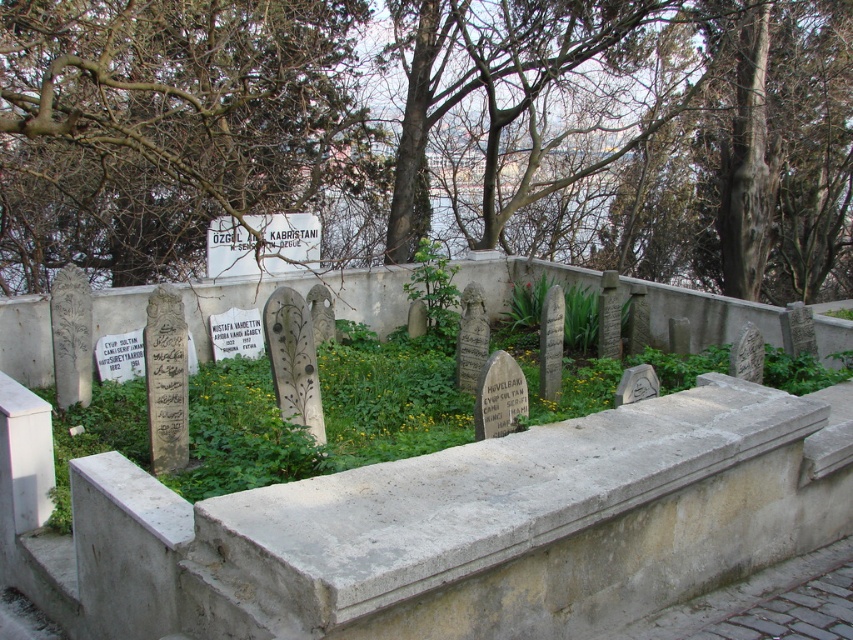
Question: Which object is closer to the camera taking this photo?

Choices:
 (A) bare branches at upper center
 (B) green leafy plant at center

Answer: (A)

Question: Is brown leafless tree at upper center further to camera compared to green leafy plant at center?

Choices:
 (A) yes
 (B) no

Answer: (B)

Question: From the image, what is the correct spatial relationship of brown leafless tree at upper center in relation to green leafy plant at center?

Choices:
 (A) above
 (B) below

Answer: (A)

Question: Which point is closer to the camera?

Choices:
 (A) bare branches at upper center
 (B) brown leafless tree at upper center
 (C) green leafy plant at center

Answer: (B)

Question: Which point is closer to the camera?

Choices:
 (A) brown leafless tree at upper center
 (B) bare branches at upper center
 (C) green leafy plant at center

Answer: (A)

Question: Does bare branches at upper center appear under green leafy plant at center?

Choices:
 (A) no
 (B) yes

Answer: (A)